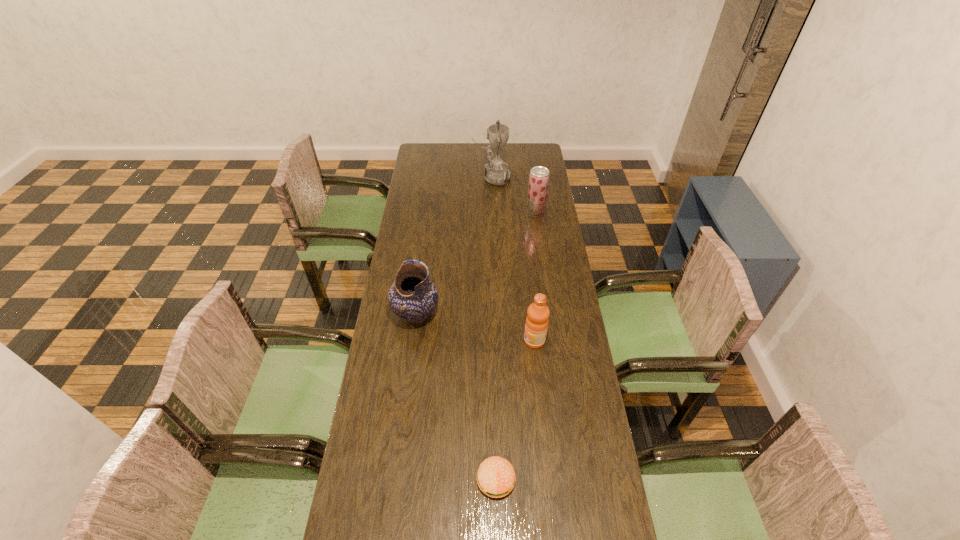
This screenshot has width=960, height=540. Identify the location of the second closest object to the patty. (413, 296).

Identify the location of free space that satisfies the following two spatial constraints: 1. on the side with emblem of the tallest object; 2. on the right side of the fourth nearest object. (492, 213).

This screenshot has height=540, width=960. Find the location of `free space that satisfies the following two spatial constraints: 1. on the side with emblem of the farthest object; 2. on the front side of the pottery`. free space that satisfies the following two spatial constraints: 1. on the side with emblem of the farthest object; 2. on the front side of the pottery is located at coordinates (496, 314).

Find the location of `vacant area that satisfies the following two spatial constraints: 1. on the back side of the farther fruit juice; 2. on the right side of the shortest object`. vacant area that satisfies the following two spatial constraints: 1. on the back side of the farther fruit juice; 2. on the right side of the shortest object is located at coordinates (490, 213).

This screenshot has height=540, width=960. I want to click on vacant area that satisfies the following two spatial constraints: 1. on the side with emblem of the farthest object; 2. on the left side of the farther fruit juice, so click(492, 213).